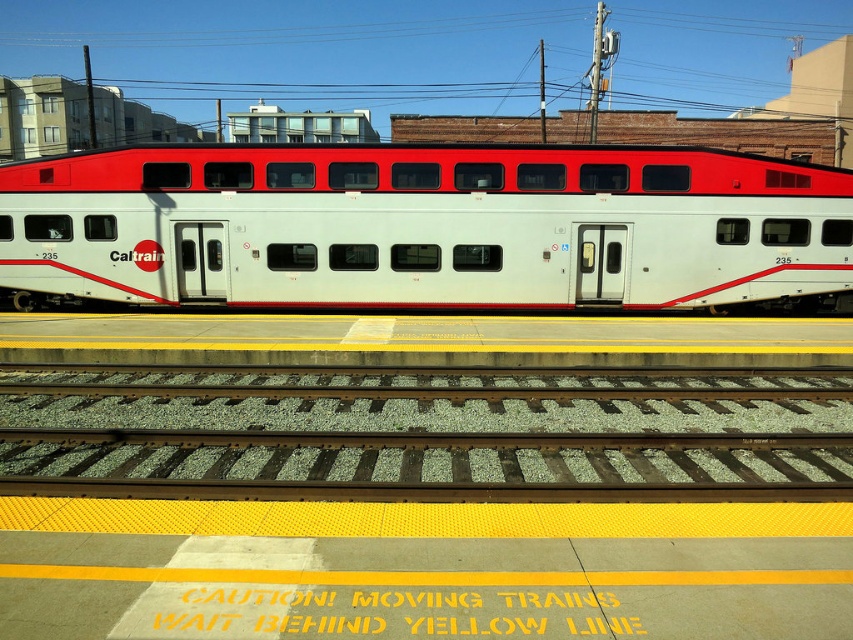
Question: Can you confirm if white matte train car at center is positioned to the right of green gravel track at center?

Choices:
 (A) no
 (B) yes

Answer: (A)

Question: Where is white matte train car at center located in relation to green gravel track at center in the image?

Choices:
 (A) below
 (B) above

Answer: (B)

Question: Which of the following is the closest to the observer?

Choices:
 (A) white matte train car at center
 (B) green gravel track at center

Answer: (B)

Question: Can you confirm if white matte train car at center is smaller than green gravel track at center?

Choices:
 (A) no
 (B) yes

Answer: (A)

Question: Which point is farther to the camera?

Choices:
 (A) (761, 435)
 (B) (339, 172)

Answer: (B)